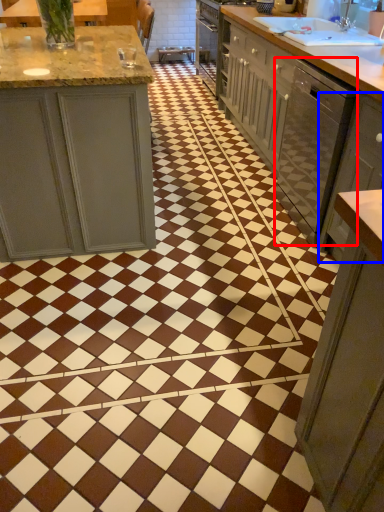
Question: Which of the following is the farthest to the observer, dish washer (highlighted by a red box) or cabinetry (highlighted by a blue box)?

Choices:
 (A) dish washer
 (B) cabinetry

Answer: (A)